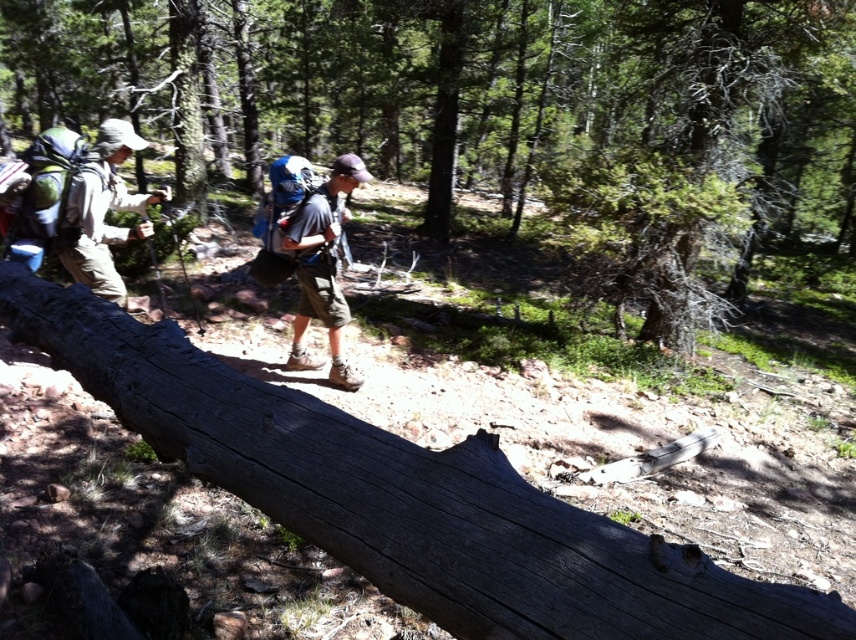
You are a hiker trying to cross the forest trail. You see a smooth gray log at center and a matte blue backpack at center. Which object is positioned to the left from your perspective?

The smooth gray log at center is to the left of the matte blue backpack at center.